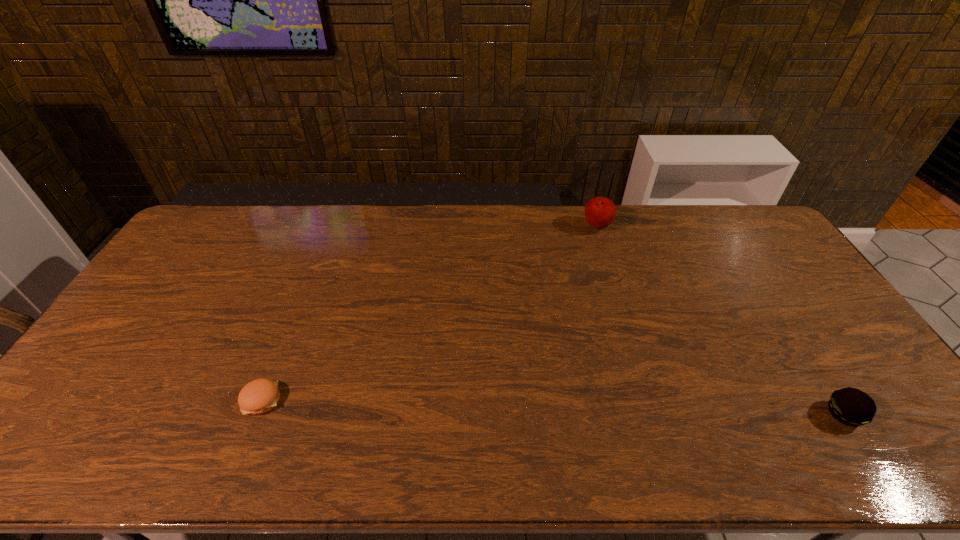
Image resolution: width=960 pixels, height=540 pixels. I want to click on the farthest object, so click(600, 212).

The width and height of the screenshot is (960, 540). I want to click on apple, so click(600, 212).

Where is `the taller patty`? This screenshot has height=540, width=960. the taller patty is located at coordinates (850, 406).

I want to click on the right patty, so click(850, 406).

I want to click on the shortest object, so pos(259,396).

Find the location of a particular element. the shorter patty is located at coordinates (259, 396).

Image resolution: width=960 pixels, height=540 pixels. I want to click on vacant area located on the left of the apple, so click(x=476, y=227).

Where is `blank space located 0.260m on the left of the rightmost object`? This screenshot has width=960, height=540. blank space located 0.260m on the left of the rightmost object is located at coordinates (720, 414).

Locate an element on the screen. The height and width of the screenshot is (540, 960). blank space located 0.170m on the back of the left patty is located at coordinates (289, 332).

Locate an element on the screen. object present at the far edge is located at coordinates (600, 212).